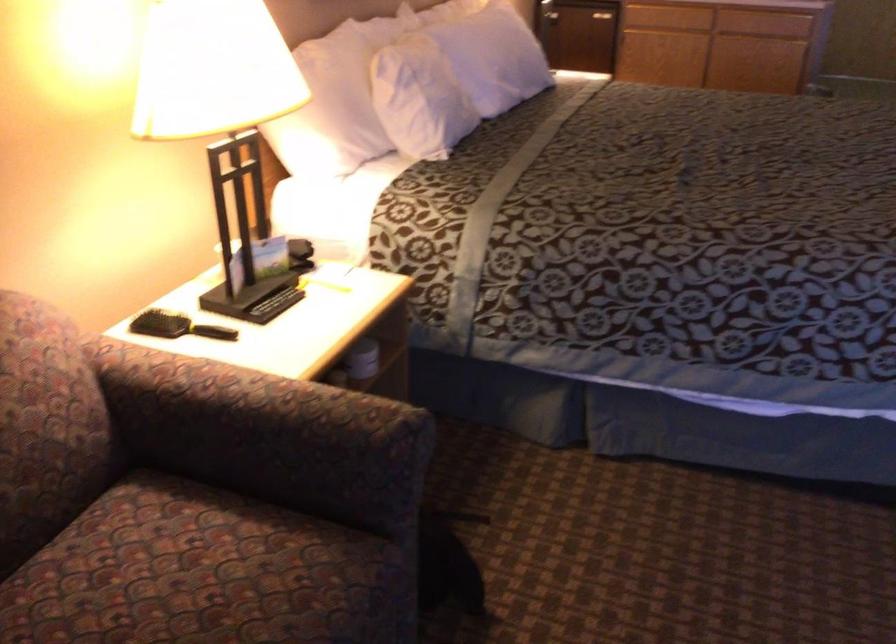
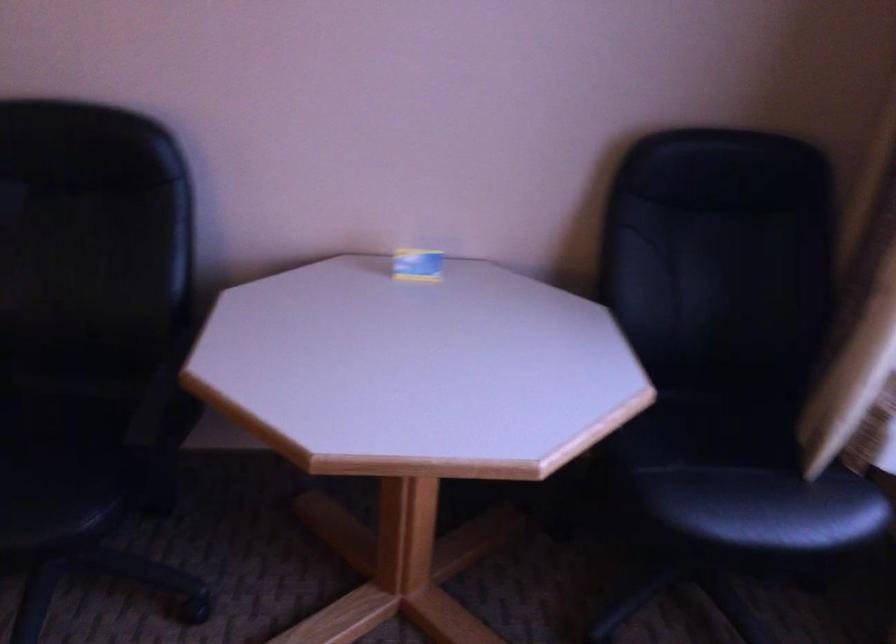
The images are taken continuously from a first-person perspective. In which direction is your viewpoint rotating?

The camera's rotation is toward right-down.